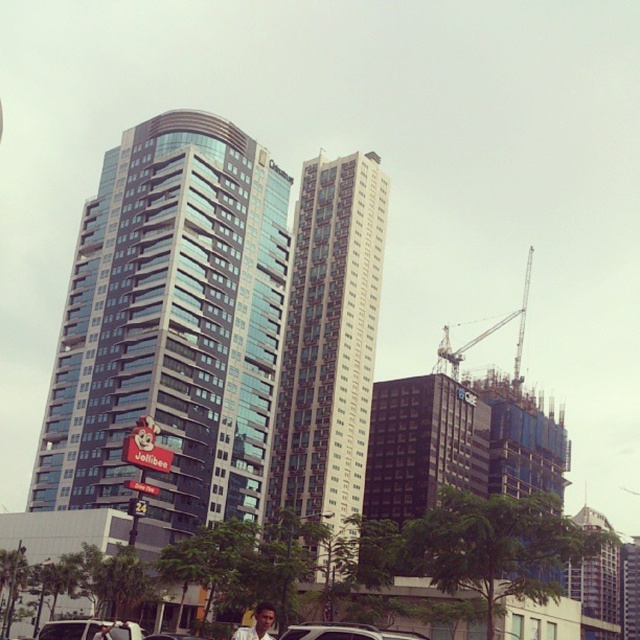
Is metallic silver car at center positioned behind dark brown hair at center?

That is True.

Does metallic silver car at center have a smaller size compared to dark brown hair at center?

No.

Based on the photo, measure the distance between metallic silver car at center and camera.

The distance of metallic silver car at center from camera is 32.98 meters.

The image size is (640, 640). Identify the location of metallic silver car at center. (172, 636).

Which is in front, point (288, 330) or point (592, 508)?

Positioned in front is point (288, 330).

In the scene shown: Is white glass building at center bigger than glassy glass building at center?

Actually, white glass building at center might be smaller than glassy glass building at center.

This screenshot has width=640, height=640. What are the coordinates of `white glass building at center` in the screenshot? It's located at (330, 342).

At what (x,y) coordinates should I click in order to perform the action: click on white glass building at center. Please return your answer as a coordinate pair (x, y). Image resolution: width=640 pixels, height=640 pixels. Looking at the image, I should click on (330, 342).

Can you confirm if white glass building at center is positioned to the left of metallic gray crane at right?

Correct, you'll find white glass building at center to the left of metallic gray crane at right.

Describe the element at coordinates (330, 342) in the screenshot. The width and height of the screenshot is (640, 640). I see `white glass building at center` at that location.

Locate an element on the screen. This screenshot has width=640, height=640. white glass building at center is located at coordinates (330, 342).

This screenshot has width=640, height=640. Identify the location of white glass building at center. (330, 342).